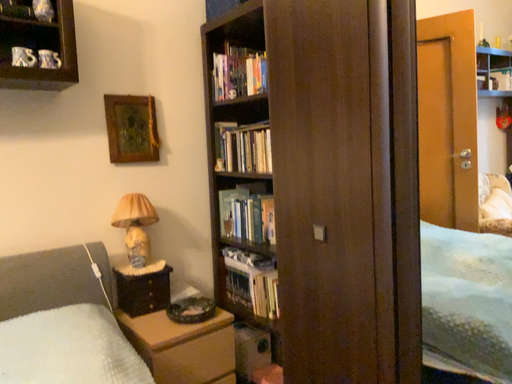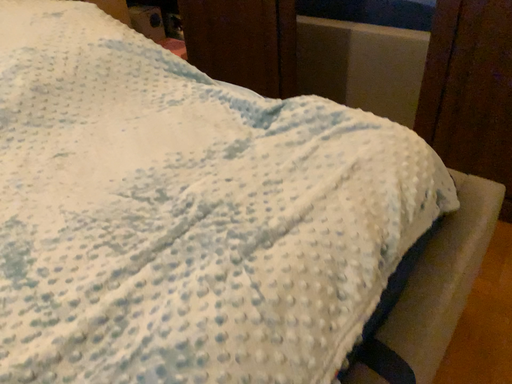
Question: How did the camera likely rotate when shooting the video?

Choices:
 (A) rotated left
 (B) rotated right

Answer: (B)